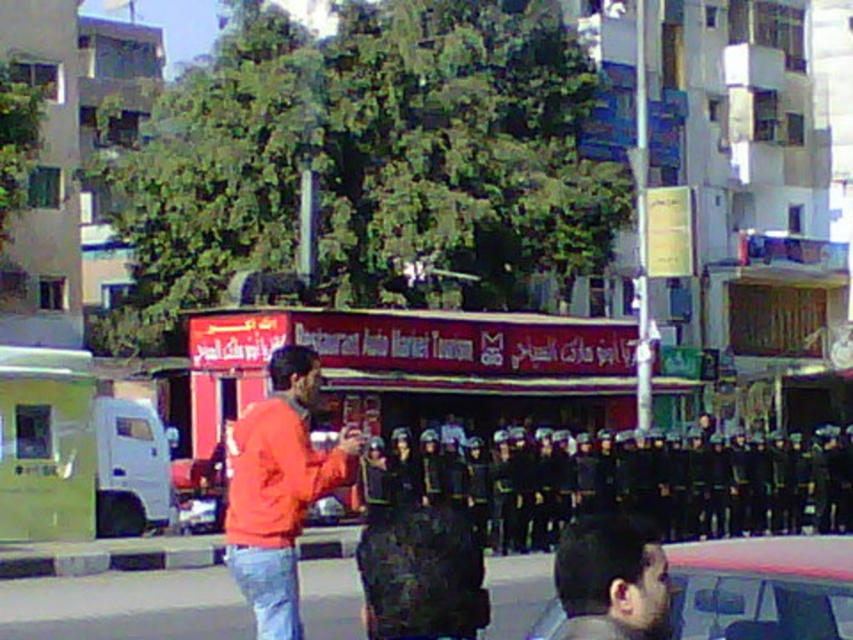
Question: Can you confirm if red matte food truck at center is wider than black uniformed soldiers at center?

Choices:
 (A) no
 (B) yes

Answer: (B)

Question: Based on their relative distances, which object is farther from the black uniformed soldiers at center?

Choices:
 (A) metallic silver car at lower right
 (B) orange matte jacket at center
 (C) smooth black hair at lower right

Answer: (B)

Question: Does black uniformed soldiers at center have a smaller size compared to orange matte jacket at center?

Choices:
 (A) no
 (B) yes

Answer: (B)

Question: Can you confirm if black uniformed soldiers at center is wider than orange matte jacket at center?

Choices:
 (A) no
 (B) yes

Answer: (B)

Question: Which point appears farthest from the camera in this image?

Choices:
 (A) (276, 592)
 (B) (666, 564)
 (C) (747, 573)
 (D) (433, 380)

Answer: (D)

Question: Which point appears farthest from the camera in this image?

Choices:
 (A) (517, 337)
 (B) (582, 605)
 (C) (712, 602)

Answer: (A)